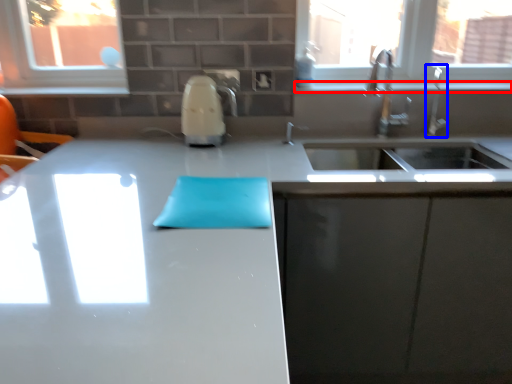
Question: Which of the following is the farthest to the observer, window sill (highlighted by a red box) or faucet (highlighted by a blue box)?

Choices:
 (A) window sill
 (B) faucet

Answer: (A)